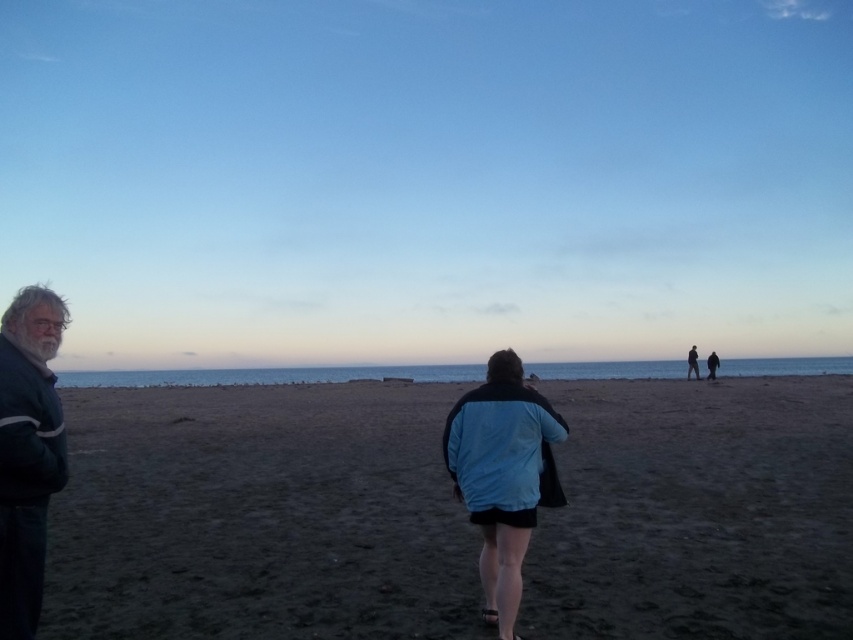
You are a photographer trying to capture a photo of the dark blue jacket at left and the dark sand at center. Which object should you focus on first if you want to ensure both are in the frame without moving the camera?

The dark sand at center is larger in size than the dark blue jacket at left, so focusing on the dark sand at center first would help ensure both objects are within the frame since it occupies more space.